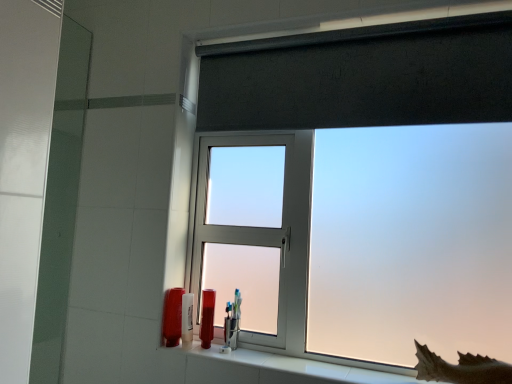
You are a GUI agent. You are given a task and a screenshot of the screen. Output one action in this format:
    pyautogui.click(x=<x>, y=<y>)
    Task: Click on the blank space situated above black textured roller blind at upper center (from a real-world perspective)
    The height and width of the screenshot is (384, 512).
    Given the screenshot: What is the action you would take?
    pyautogui.click(x=349, y=22)